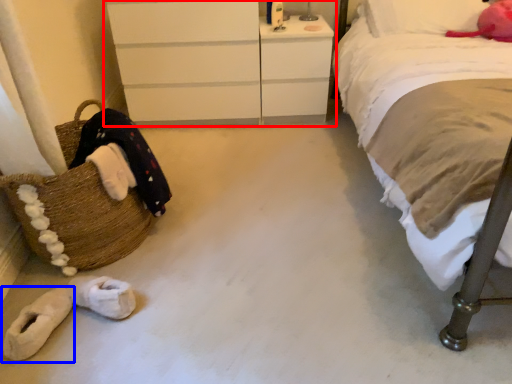
Question: Which object appears closest to the camera in this image, chest of drawers (highlighted by a red box) or footwear (highlighted by a blue box)?

Choices:
 (A) chest of drawers
 (B) footwear

Answer: (B)